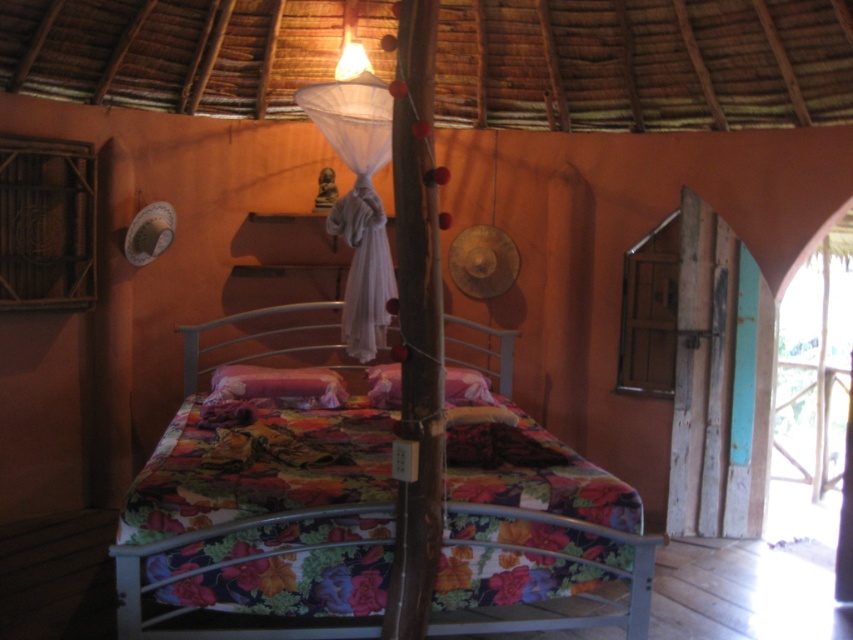
Who is taller, floral fabric bed at center or velvet pink pillow at center?

With more height is floral fabric bed at center.

Between point (224, 568) and point (315, 396), which one is positioned behind?

The point (315, 396) is more distant.

The image size is (853, 640). What are the coordinates of `floral fabric bed at center` in the screenshot? It's located at (262, 522).